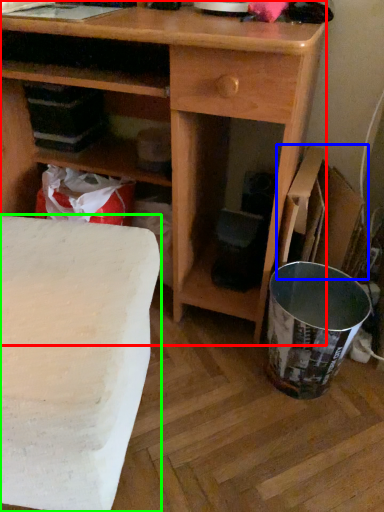
Question: Estimate the real-world distances between objects in this image. Which object is farther from desk (highlighted by a red box), cardboard box (highlighted by a blue box) or table (highlighted by a green box)?

Choices:
 (A) cardboard box
 (B) table

Answer: (B)